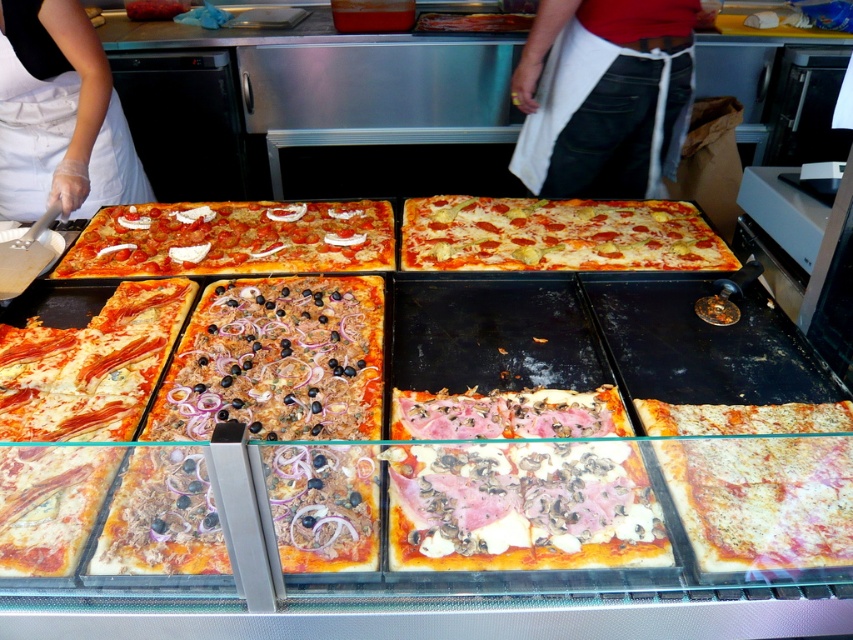
You are a customer standing in front of the display case and want to point out the white cheese pizza at center and the white apron at center to the staff. Which one is closer to the floor?

The white cheese pizza at center is shorter than the white apron at center, so the white cheese pizza at center is closer to the floor.

You are a customer at the pizzeria looking at the display case. You notice the shiny red pizza with onions and olives at center and the white apron at center. Which object is shorter in height?

The shiny red pizza with onions and olives at center is shorter in height compared to the white apron at center.